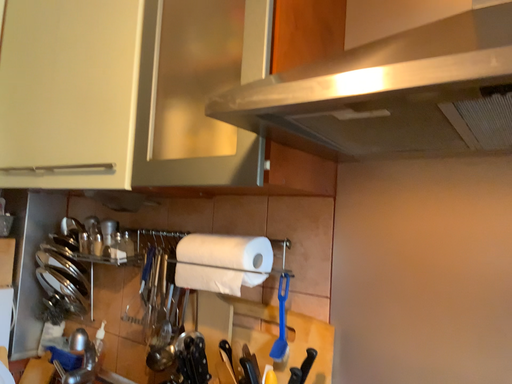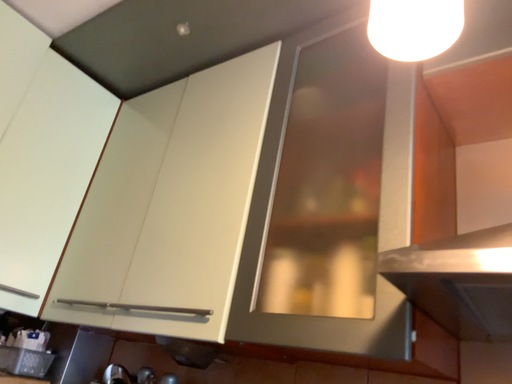
Question: Which way did the camera rotate in the video?

Choices:
 (A) rotated upward
 (B) rotated downward

Answer: (A)